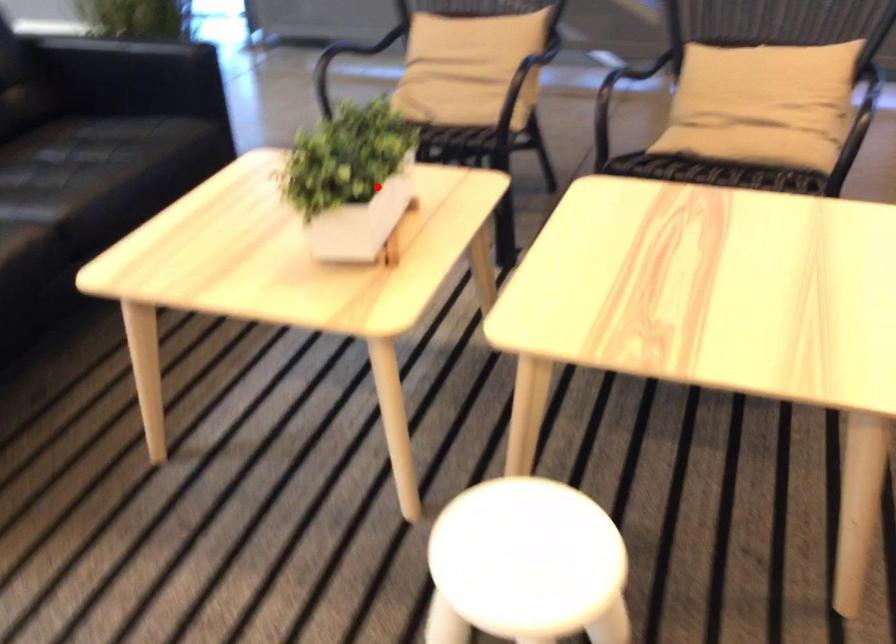
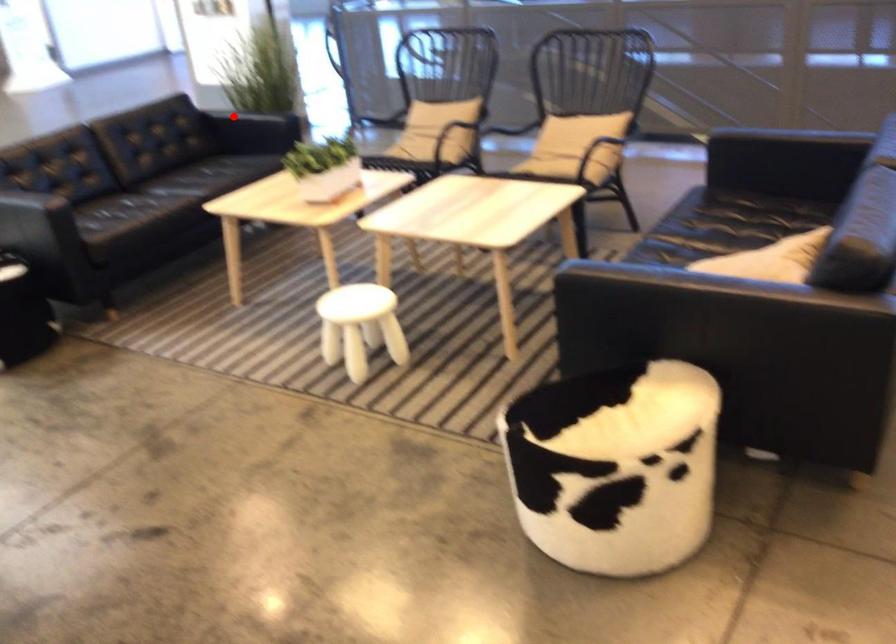
I am providing you with two images of the same scene from different viewpoints. A red point is marked on the first image and another point is marked on the second image. Do the highlighted points in image1 and image2 indicate the same real-world spot?

No